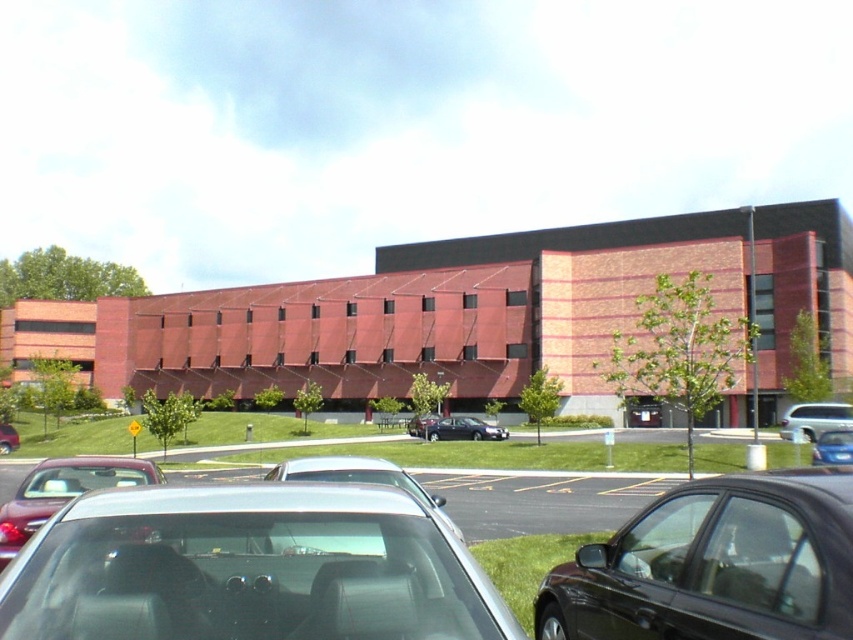
Question: Is metallic silver car at lower center closer to the viewer compared to sleek silver sedan at center?

Choices:
 (A) yes
 (B) no

Answer: (B)

Question: From the image, what is the correct spatial relationship of black glossy car at lower right in relation to metallic silver van at center?

Choices:
 (A) below
 (B) above

Answer: (B)

Question: Estimate the real-world distances between objects in this image. Which object is closer to the sleek silver sedan at center?

Choices:
 (A) shiny black sedan at center
 (B) metallic silver van at center
 (C) blue metallic sedan at center

Answer: (A)

Question: Which object appears farthest from the camera in this image?

Choices:
 (A) metallic silver van at center
 (B) black glossy car at lower right
 (C) matte silver sedan at lower left

Answer: (A)

Question: Can you confirm if metallic silver car at lower center is positioned to the left of matte black sedan at center?

Choices:
 (A) yes
 (B) no

Answer: (B)

Question: Based on their relative distances, which object is nearer to the metallic silver van at center?

Choices:
 (A) metallic silver car at lower center
 (B) shiny black sedan at center
 (C) matte silver sedan at lower left
 (D) matte black sedan at center

Answer: (B)